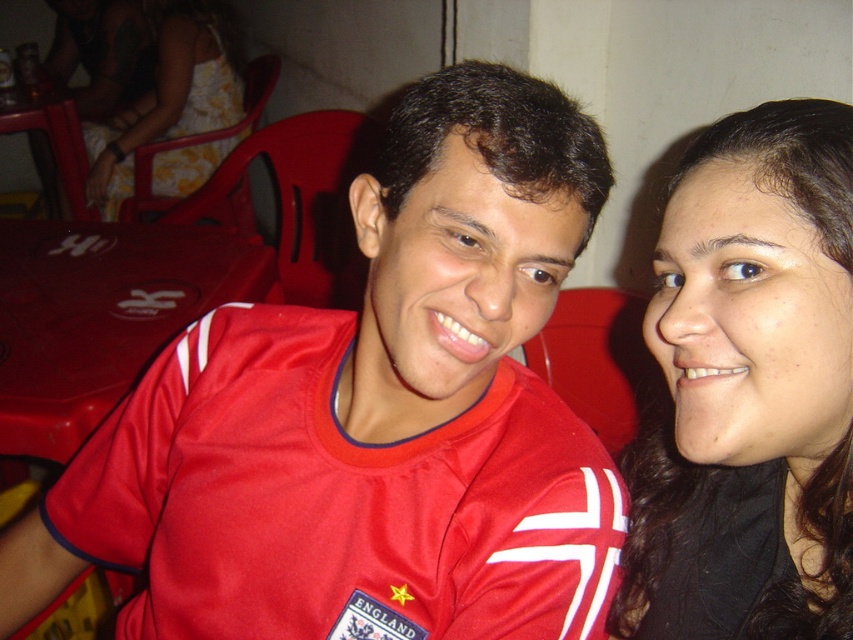
Does black matte hair at upper right appear on the left side of yellow floral dress at upper left?

Incorrect, black matte hair at upper right is not on the left side of yellow floral dress at upper left.

Does point (840, 262) come farther from viewer compared to point (143, 120)?

That is False.

Locate an element on the screen. The image size is (853, 640). black matte hair at upper right is located at coordinates (749, 388).

Who is lower down, matte red jersey at center or yellow floral dress at upper left?

matte red jersey at center is below.

Which is more to the left, matte red jersey at center or yellow floral dress at upper left?

Positioned to the left is yellow floral dress at upper left.

Which is behind, point (154, 444) or point (192, 148)?

Point (192, 148)

This screenshot has height=640, width=853. In order to click on matte red jersey at center in this screenshot , I will do `click(369, 417)`.

Does matte red jersey at center appear under black matte hair at upper right?

Indeed, matte red jersey at center is positioned under black matte hair at upper right.

Which is below, matte red jersey at center or black matte hair at upper right?

matte red jersey at center is below.

This screenshot has height=640, width=853. I want to click on matte red jersey at center, so click(x=369, y=417).